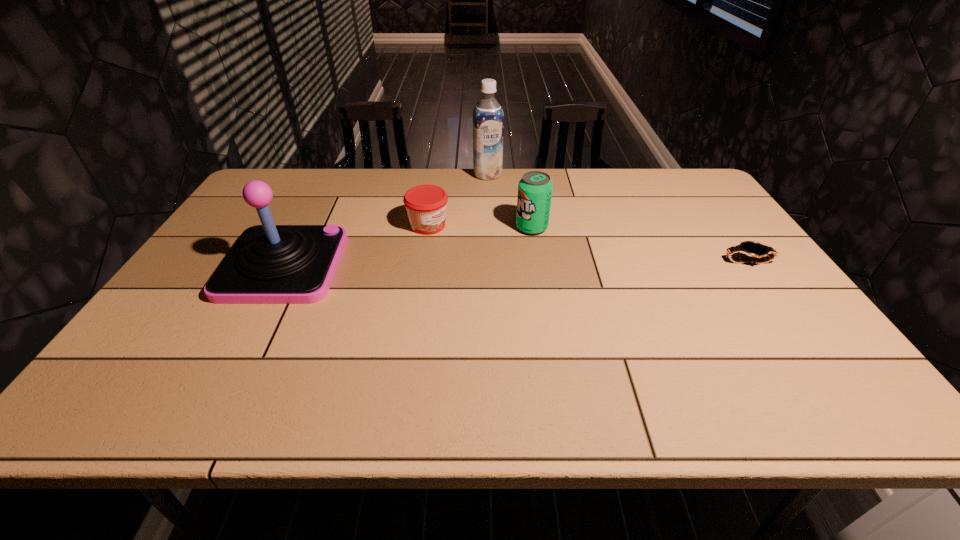
The width and height of the screenshot is (960, 540). Find the location of `the leftmost object`. the leftmost object is located at coordinates (269, 264).

Locate an element on the screen. the fourth shortest object is located at coordinates (269, 264).

Where is `watch`? The image size is (960, 540). watch is located at coordinates (750, 248).

Where is `the rightmost object`? the rightmost object is located at coordinates (750, 248).

Where is `the fourth object from left to right`? This screenshot has height=540, width=960. the fourth object from left to right is located at coordinates (535, 188).

Where is `pop soda`? Image resolution: width=960 pixels, height=540 pixels. pop soda is located at coordinates (535, 188).

Find the location of a particular element. The height and width of the screenshot is (540, 960). the farthest object is located at coordinates (488, 118).

Where is `the third object from right to left`? the third object from right to left is located at coordinates (488, 118).

Find the location of a particular element. The image size is (960, 540). the fourth object from right to left is located at coordinates (426, 205).

At what (x,y) coordinates should I click in order to perform the action: click on the second shortest object. Please return your answer as a coordinate pair (x, y). The image size is (960, 540). Looking at the image, I should click on (426, 205).